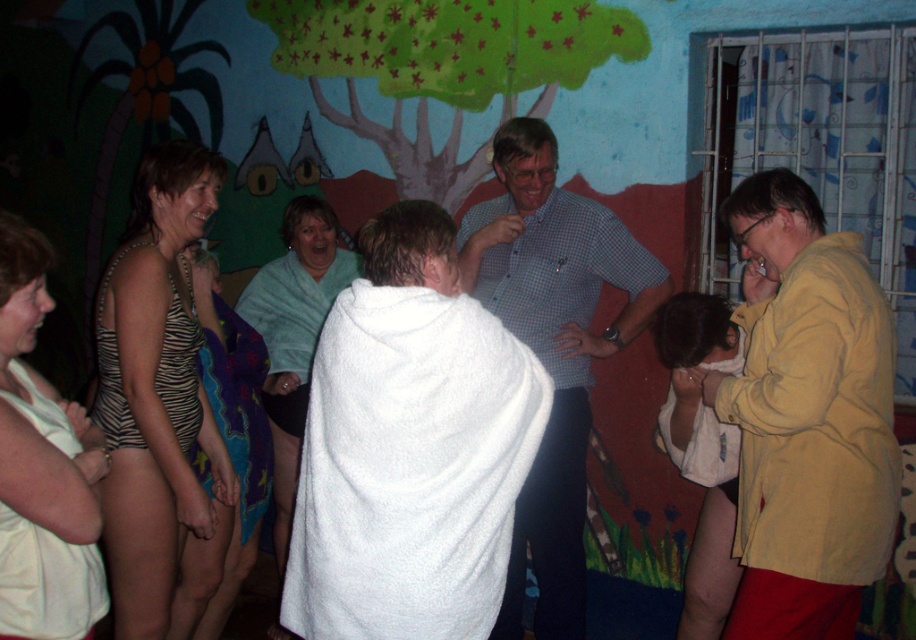
You are a photographer trying to capture a candid shot of the checkered fabric shirt at center and the teal towel at center. You need to ensure both are in focus. Given that your camera has a depth of field that can cover 36 inches, will both objects be in focus?

The checkered fabric shirt at center and teal towel at center are 36.67 inches apart from each other. Since the camera can only cover 36 inches, the distance between them exceeds the depth of field capacity. Therefore, both objects might not be in focus simultaneously.

You are standing at the position of point (277, 442) and want to move towards the mural. Can you walk straight ahead without passing through point (521, 544)?

Point (521, 544) is in front of point (277, 442), so walking straight ahead towards the mural would require passing through point (521, 544).

You are a photographer trying to capture a clear shot of both the checkered fabric shirt at center and the teal towel at center. Since they are positioned close to each other, will you need to adjust your focus to ensure both are in focus?

The checkered fabric shirt at center is in front of the teal towel at center, so to have both in focus, the photographer should adjust the focus to include the depth of field covering both objects.